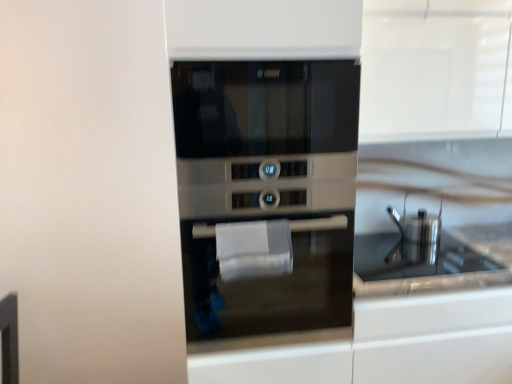
The image size is (512, 384). What do you see at coordinates (426, 249) in the screenshot? I see `glossy stainless steel sink at center` at bounding box center [426, 249].

The width and height of the screenshot is (512, 384). What do you see at coordinates (417, 224) in the screenshot? I see `satin silver oven at center` at bounding box center [417, 224].

You are a GUI agent. You are given a task and a screenshot of the screen. Output one action in this format:
    pyautogui.click(x=<x>, y=<y>)
    Task: Click on the satin silver oven at center
    
    Given the screenshot: What is the action you would take?
    (417, 224)

I want to click on glossy stainless steel sink at center, so click(426, 249).

Is satin silver oven at center taller or shorter than glossy stainless steel sink at center?

satin silver oven at center is taller than glossy stainless steel sink at center.

Can you tell me how much satin silver oven at center and glossy stainless steel sink at center differ in facing direction?

They differ by 0.000221 degrees in their facing directions.

Is satin silver oven at center not near glossy stainless steel sink at center?

No, there isn't a large distance between satin silver oven at center and glossy stainless steel sink at center.

Which object is closer to the camera taking this photo, satin silver oven at center or glossy stainless steel sink at center?

glossy stainless steel sink at center is closer to the camera.

Which point is more forward, [387,252] or [237,241]?

The point [237,241] is more forward.

Would you say glossy stainless steel sink at center is inside or outside white textured hand towel at center?

glossy stainless steel sink at center exists outside the volume of white textured hand towel at center.

From the image's perspective, is glossy stainless steel sink at center located above or below white textured hand towel at center?

Result: glossy stainless steel sink at center is below white textured hand towel at center.

Which of these two, glossy stainless steel sink at center or white textured hand towel at center, stands taller?

With more height is white textured hand towel at center.

Is glossy stainless steel sink at center taller than satin silver oven at center?

No.

Is glossy stainless steel sink at center placed right next to satin silver oven at center?

No, glossy stainless steel sink at center is not next to satin silver oven at center.

Is glossy stainless steel sink at center thinner than satin silver oven at center?

Correct, the width of glossy stainless steel sink at center is less than that of satin silver oven at center.

Is glossy stainless steel sink at center at the left side of satin silver oven at center?

In fact, glossy stainless steel sink at center is to the right of satin silver oven at center.

Is satin silver oven at center placed right next to white textured hand towel at center?

satin silver oven at center and white textured hand towel at center are clearly separated.

From a real-world perspective, is satin silver oven at center positioned above or below white textured hand towel at center?

satin silver oven at center is below white textured hand towel at center.

Does point (420, 225) come behind point (227, 268)?

Yes, point (420, 225) is farther from viewer.

Considering the relative positions of satin silver oven at center and white textured hand towel at center in the image provided, is satin silver oven at center to the right of white textured hand towel at center from the viewer's perspective?

Correct, you'll find satin silver oven at center to the right of white textured hand towel at center.

Is satin silver oven at center turned away from glossy stainless steel sink at center?

satin silver oven at center is not turned away from glossy stainless steel sink at center.

Can you tell me how much satin silver oven at center and glossy stainless steel sink at center differ in facing direction?

There is a 0.327-degree angle between the facing directions of satin silver oven at center and glossy stainless steel sink at center.

In the image, is satin silver oven at center positioned in front of or behind glossy stainless steel sink at center?

satin silver oven at center is in front of glossy stainless steel sink at center.

Which is correct: satin silver oven at center is inside glossy stainless steel sink at center, or outside of it?

satin silver oven at center is spatially situated outside glossy stainless steel sink at center.

Does satin silver oven at center appear on the left side of satin silver oven at center?

No, satin silver oven at center is not to the left of satin silver oven at center.

From a real-world perspective, is satin silver oven at center on satin silver oven at center?

No.

Is satin silver oven at center with satin silver oven at center?

No, satin silver oven at center is not next to satin silver oven at center.

Which object is further away from the camera taking this photo, white textured hand towel at center or glossy stainless steel sink at center?

Positioned behind is glossy stainless steel sink at center.

Which is farther from the camera, (265, 252) or (436, 290)?

The point (436, 290) is farther.

Is white textured hand towel at center far from glossy stainless steel sink at center?

That's not correct — white textured hand towel at center is a little close to glossy stainless steel sink at center.

Locate an element on the screen. sink below the white textured hand towel at center (from the image's perspective) is located at coordinates (426, 249).

Locate an element on the screen. Image resolution: width=512 pixels, height=384 pixels. sink in front of the satin silver oven at center is located at coordinates (426, 249).

This screenshot has height=384, width=512. I want to click on sink that is on the right side of white textured hand towel at center, so click(x=426, y=249).

Looking at the image, which one is located closer to satin silver oven at center, white textured hand towel at center or glossy stainless steel sink at center?

glossy stainless steel sink at center is closer to satin silver oven at center.

Estimate the real-world distances between objects in this image. Which object is closer to satin silver oven at center, glossy stainless steel sink at center or satin silver oven at center?

The object closer to satin silver oven at center is glossy stainless steel sink at center.

Which object lies nearer to the anchor point glossy stainless steel sink at center, satin silver oven at center or satin silver oven at center?

satin silver oven at center is closer to glossy stainless steel sink at center.

Estimate the real-world distances between objects in this image. Which object is further from white textured hand towel at center, glossy stainless steel sink at center or satin silver oven at center?

glossy stainless steel sink at center lies further to white textured hand towel at center than the other object.

From the image, which object appears to be farther from satin silver oven at center, glossy stainless steel sink at center or satin silver oven at center?

satin silver oven at center.

Based on their spatial positions, is satin silver oven at center or satin silver oven at center closer to white textured hand towel at center?

The object closer to white textured hand towel at center is satin silver oven at center.

Which object lies nearer to the anchor point satin silver oven at center, white textured hand towel at center or satin silver oven at center?

satin silver oven at center is positioned closer to the anchor satin silver oven at center.

Based on their spatial positions, is satin silver oven at center or glossy stainless steel sink at center further from satin silver oven at center?

Based on the image, satin silver oven at center appears to be further to satin silver oven at center.

I want to click on sink between white textured hand towel at center and satin silver oven at center from left to right, so click(426, 249).

The height and width of the screenshot is (384, 512). In order to click on oven situated between white textured hand towel at center and glossy stainless steel sink at center from left to right in this screenshot , I will do `click(266, 194)`.

This screenshot has height=384, width=512. I want to click on oven between white textured hand towel at center and satin silver oven at center in the horizontal direction, so click(x=266, y=194).

The image size is (512, 384). I want to click on sink between satin silver oven at center and satin silver oven at center in the horizontal direction, so click(x=426, y=249).